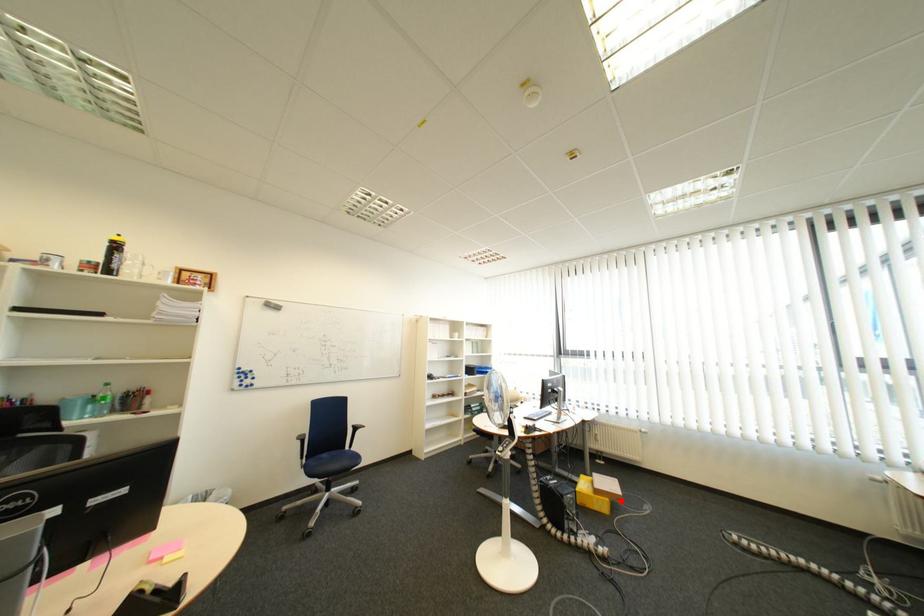
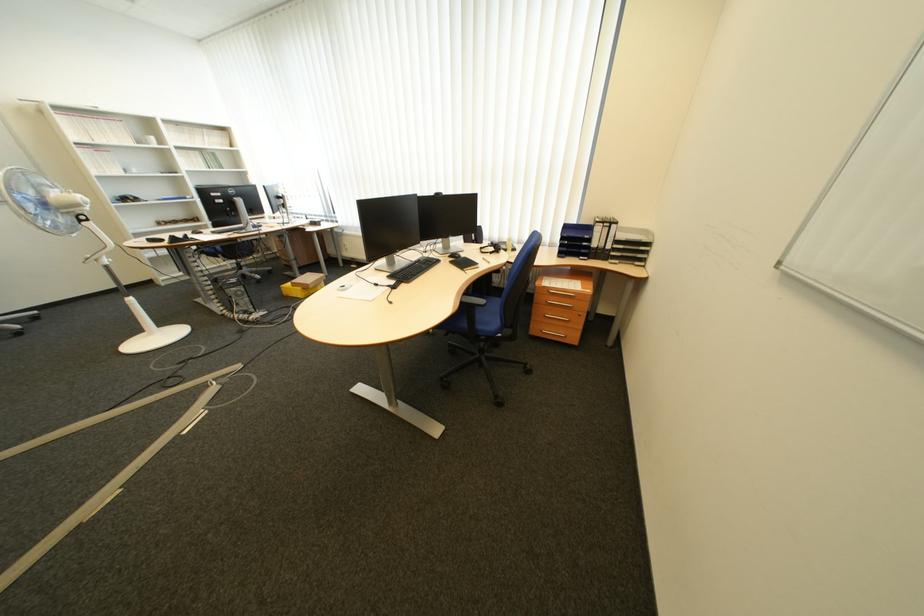
Question: I am providing you with two images of the same scene from different viewpoints. Given a red point in image1, look at the same physical point in image2. Is it:

Choices:
 (A) Closer to the viewpoint
 (B) Farther from the viewpoint

Answer: (B)